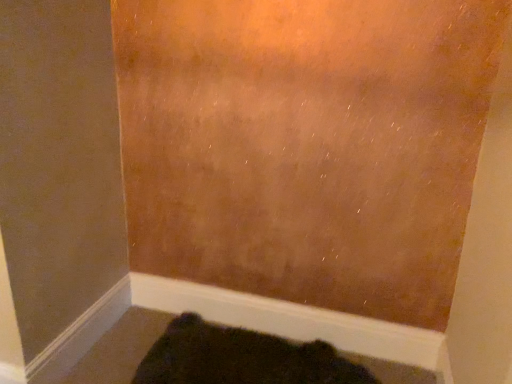
Where is `vacant region above white smooth baseboard at lower center (from a real-world perspective)`? Image resolution: width=512 pixels, height=384 pixels. vacant region above white smooth baseboard at lower center (from a real-world perspective) is located at coordinates (283, 302).